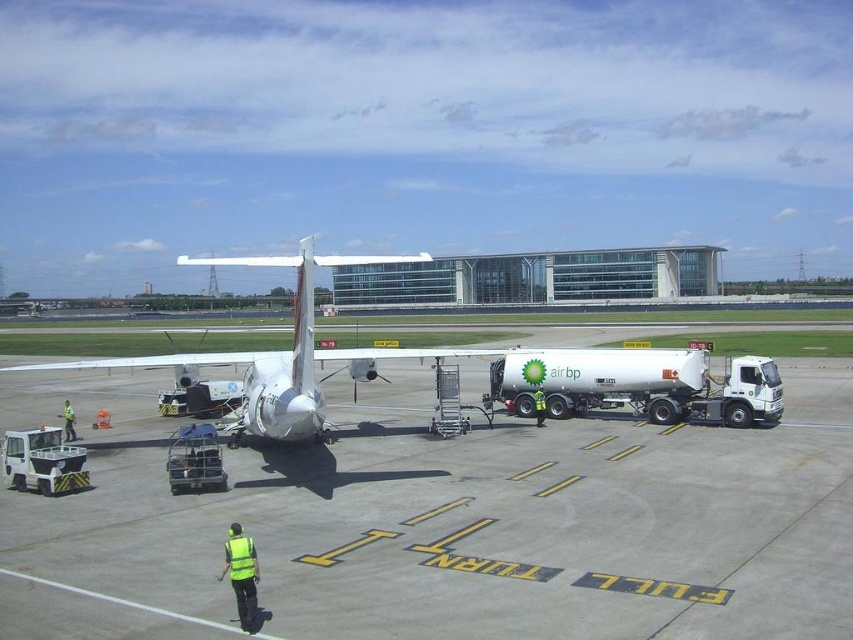
Question: Can you confirm if smooth concrete tarmac at center is smaller than white matte airplane at center?

Choices:
 (A) no
 (B) yes

Answer: (B)

Question: From the image, what is the correct spatial relationship of white matte airplane at center in relation to reflective yellow vest at lower center?

Choices:
 (A) right
 (B) left

Answer: (B)

Question: Which of the following is the closest to the observer?

Choices:
 (A) (310, 429)
 (B) (665, 253)
 (C) (247, 625)
 (D) (244, 500)

Answer: (C)

Question: Which point is closer to the camera?

Choices:
 (A) smooth concrete tarmac at center
 (B) white matte airplane at center
 (C) glassy modern building at center

Answer: (A)

Question: From the image, what is the correct spatial relationship of glassy modern building at center in relation to reflective yellow vest at lower center?

Choices:
 (A) above
 (B) below

Answer: (A)

Question: Which of the following is the farthest from the observer?

Choices:
 (A) smooth concrete tarmac at center
 (B) glassy modern building at center
 (C) reflective yellow vest at lower center
 (D) white matte airplane at center

Answer: (B)